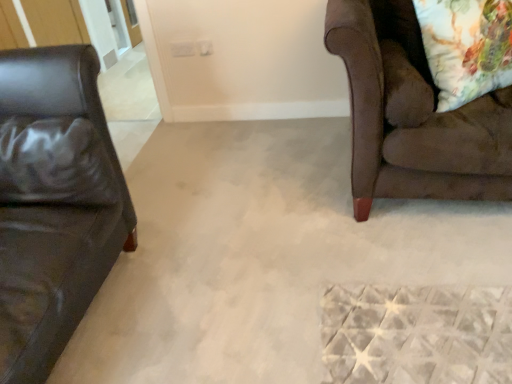
Where is `vacant space that is to the left of brown suede couch at right`? vacant space that is to the left of brown suede couch at right is located at coordinates (239, 204).